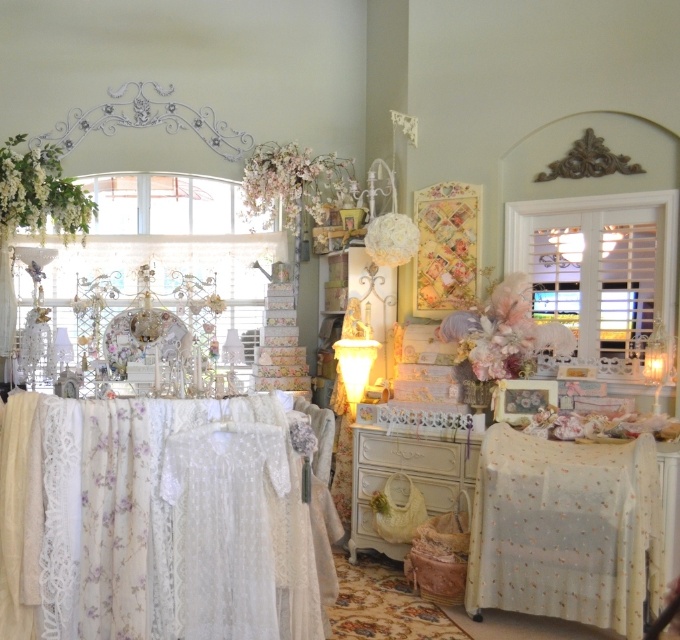
Question: Can you confirm if white lace tablecloth at lower left is thinner than light beige lace tablecloth at lower right?

Choices:
 (A) no
 (B) yes

Answer: (A)

Question: Does white lace tablecloth at lower left have a greater width compared to light beige lace tablecloth at lower right?

Choices:
 (A) no
 (B) yes

Answer: (B)

Question: Does white lace tablecloth at lower left appear on the right side of light beige lace tablecloth at lower right?

Choices:
 (A) no
 (B) yes

Answer: (A)